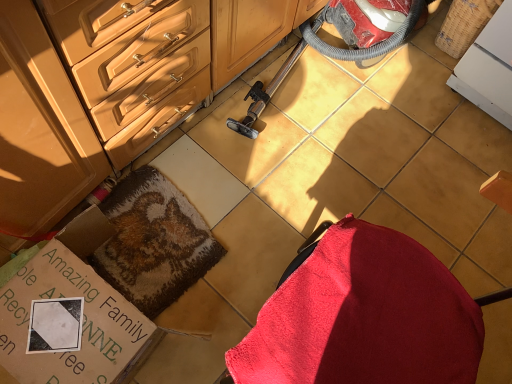
Locate an element on the screen. The height and width of the screenshot is (384, 512). free point in front of red plastic vacuum cleaner at center is located at coordinates (336, 198).